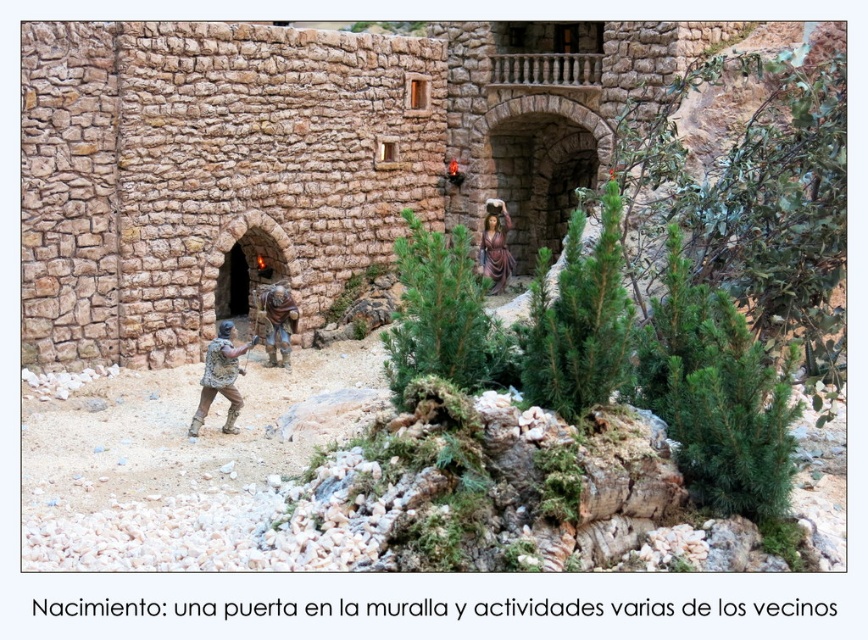
Question: Among these points, which one is nearest to the camera?

Choices:
 (A) (275, 321)
 (B) (132, 156)
 (C) (217, 342)
 (D) (487, 252)

Answer: (C)

Question: Among these objects, which one is nearest to the camera?

Choices:
 (A) matte brown armor at center
 (B) matte brown statue at center
 (C) brown fabric figure at center

Answer: (A)

Question: Is brown stone wall at center behind matte brown armor at center?

Choices:
 (A) yes
 (B) no

Answer: (A)

Question: Which object is farther from the camera taking this photo?

Choices:
 (A) brown fabric figure at center
 (B) matte brown armor at center
 (C) brown stone wall at center

Answer: (A)

Question: Does brown stone wall at center appear over matte brown statue at center?

Choices:
 (A) no
 (B) yes

Answer: (B)

Question: Does brown stone wall at center have a smaller size compared to brown fabric figure at center?

Choices:
 (A) yes
 (B) no

Answer: (B)